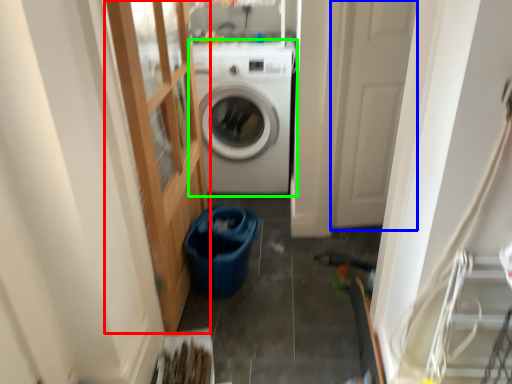
Question: Which object is the farthest from glass door (highlighted by a red box)? Choose among these: screen door (highlighted by a blue box) or washing machine (highlighted by a green box).

Choices:
 (A) screen door
 (B) washing machine

Answer: (A)